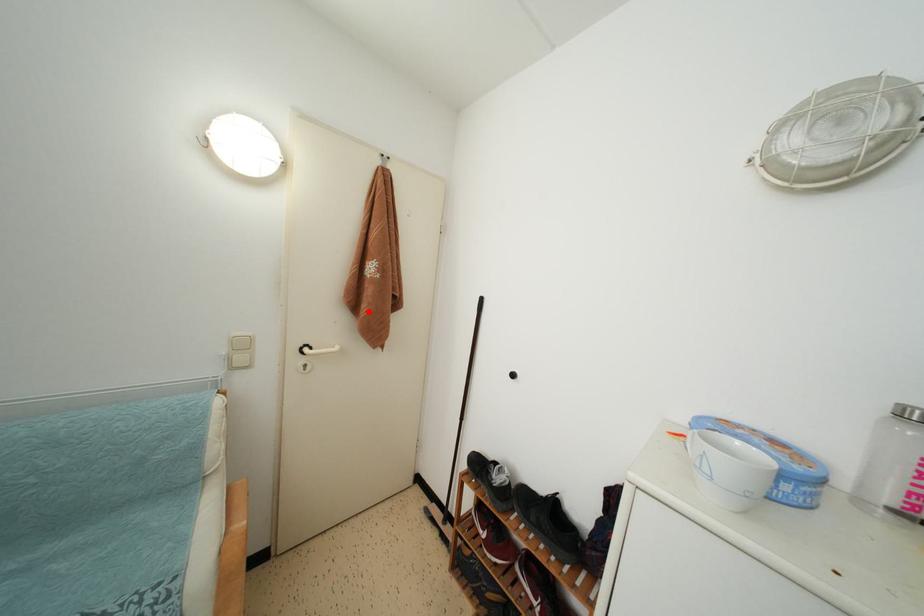
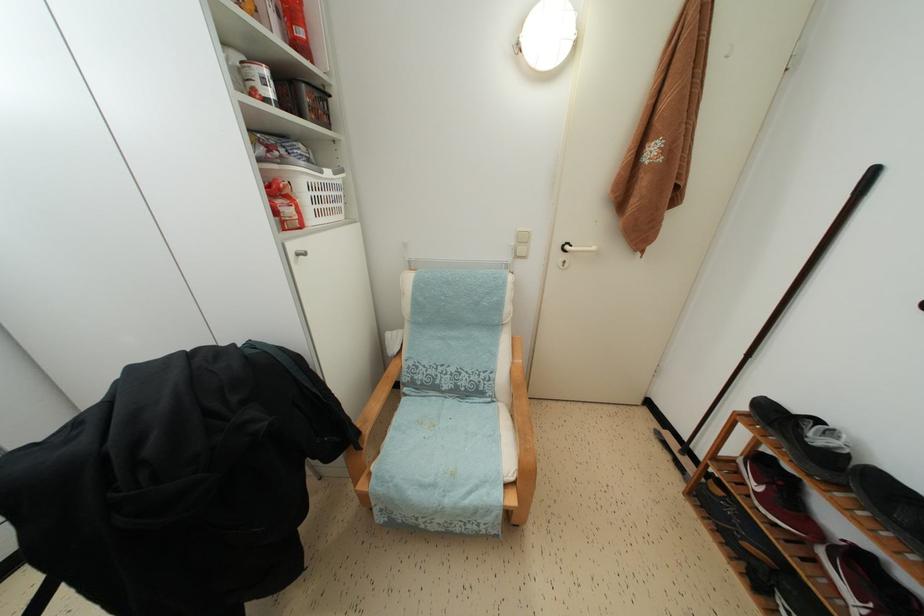
Locate, in the second image, the point that corresponds to the highlighted location in the first image.

(638, 207)